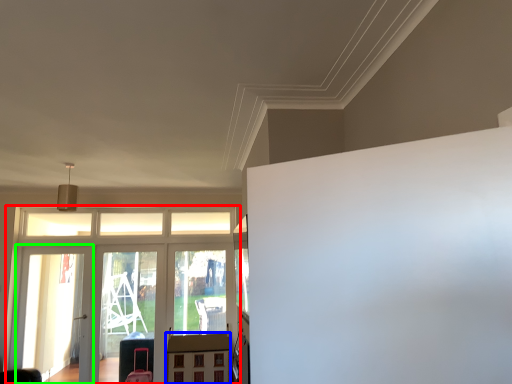
Question: Estimate the real-world distances between objects in this image. Which object is farther from elevator (highlighted by a red box), table (highlighted by a blue box) or screen door (highlighted by a green box)?

Choices:
 (A) table
 (B) screen door

Answer: (A)